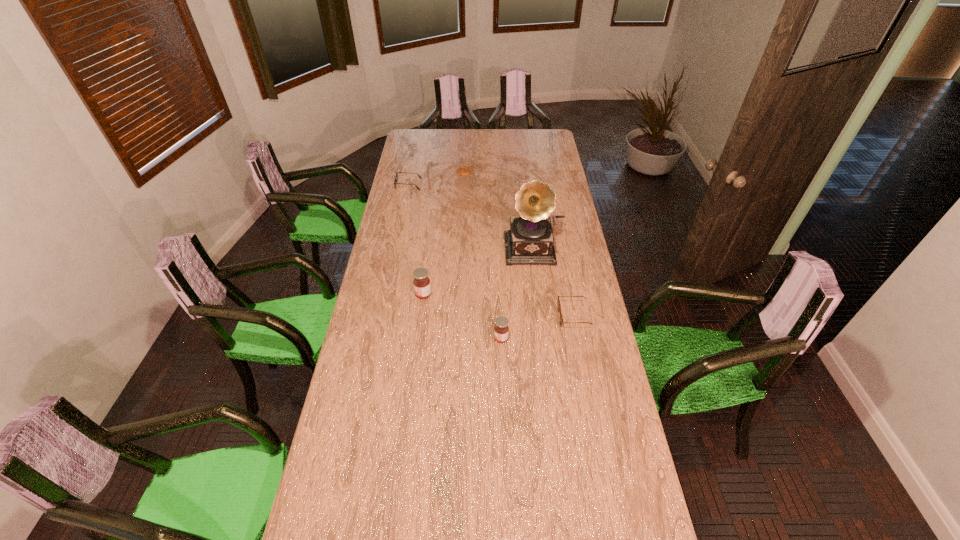
You are a GUI agent. You are given a task and a screenshot of the screen. Output one action in this format:
    pyautogui.click(x=<x>, y=<y>)
    Task: Click on the fifth farthest object
    
    Given the screenshot: What is the action you would take?
    pyautogui.click(x=558, y=301)

This screenshot has height=540, width=960. Find the location of `the nearer spectacles`. the nearer spectacles is located at coordinates (558, 301).

Identify the location of vacant position located on the label side of the farther jam. (397, 294).

Find the location of a particular element. vacant space located 0.180m on the label side of the farther jam is located at coordinates (371, 294).

What are the coordinates of `free region located 0.200m on the label side of the farther jam` in the screenshot? It's located at (366, 294).

The image size is (960, 540). In order to click on vacant space situated 0.340m on the label side of the nearer jam in this screenshot , I will do `click(402, 339)`.

Locate an element on the screen. This screenshot has height=540, width=960. free space located on the label side of the nearer jam is located at coordinates (400, 339).

Where is `vacant point located on the label side of the nearer jam`? The width and height of the screenshot is (960, 540). vacant point located on the label side of the nearer jam is located at coordinates (387, 339).

Locate an element on the screen. vacant space situated 0.110m on the left of the cookie is located at coordinates (437, 171).

This screenshot has height=540, width=960. In order to click on vacant space located 0.350m with the lenses facing outward on the second farthest object in this screenshot , I will do `click(487, 185)`.